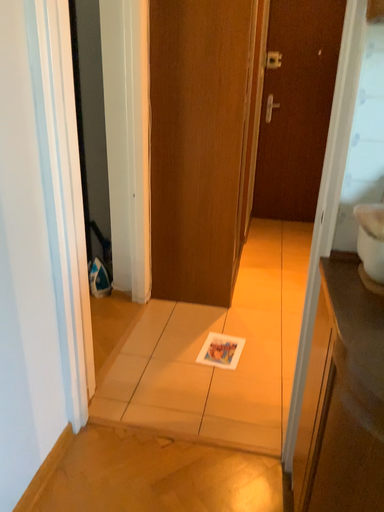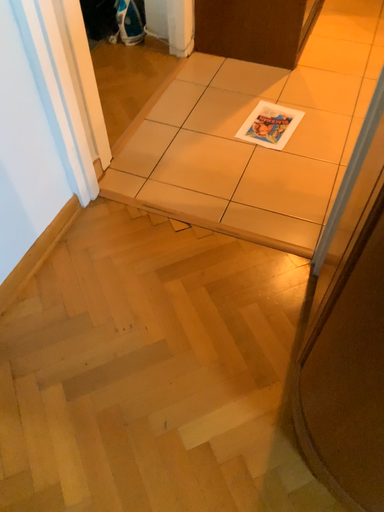
Question: How did the camera likely rotate when shooting the video?

Choices:
 (A) rotated left
 (B) rotated right

Answer: (A)